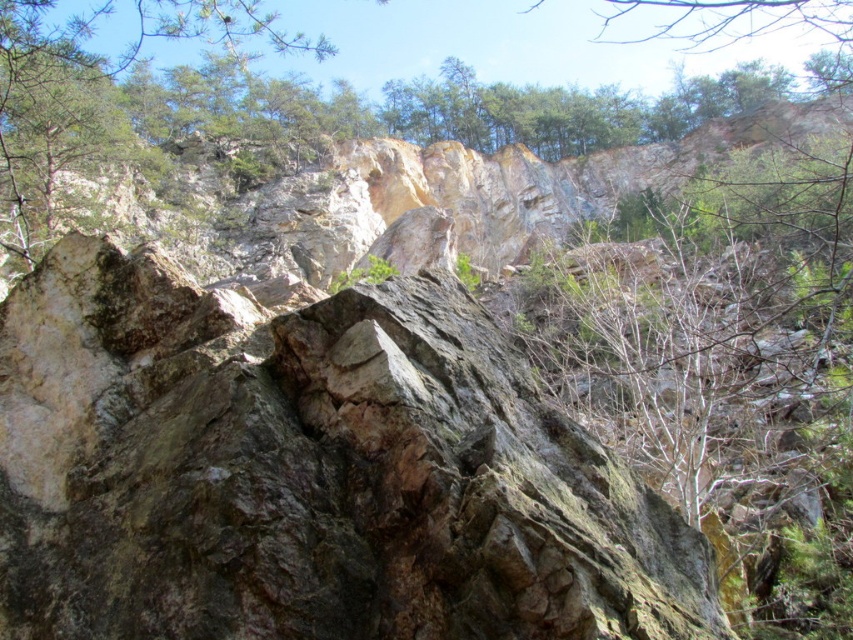
Question: Is rocky cliff at center below green rough rock at upper left?

Choices:
 (A) no
 (B) yes

Answer: (B)

Question: Which is nearer to the green leafy tree at upper center?

Choices:
 (A) rocky cliff at center
 (B) green rough rock at upper left

Answer: (B)

Question: Is green leafy tree at upper center wider than green rough rock at upper left?

Choices:
 (A) no
 (B) yes

Answer: (B)

Question: Among these objects, which one is farthest from the camera?

Choices:
 (A) rocky cliff at center
 (B) green leafy tree at upper center

Answer: (B)

Question: Can you confirm if rocky cliff at center is positioned below green leafy tree at upper center?

Choices:
 (A) yes
 (B) no

Answer: (A)

Question: Which of these objects is positioned farthest from the green rough rock at upper left?

Choices:
 (A) rocky cliff at center
 (B) green leafy tree at upper center

Answer: (B)